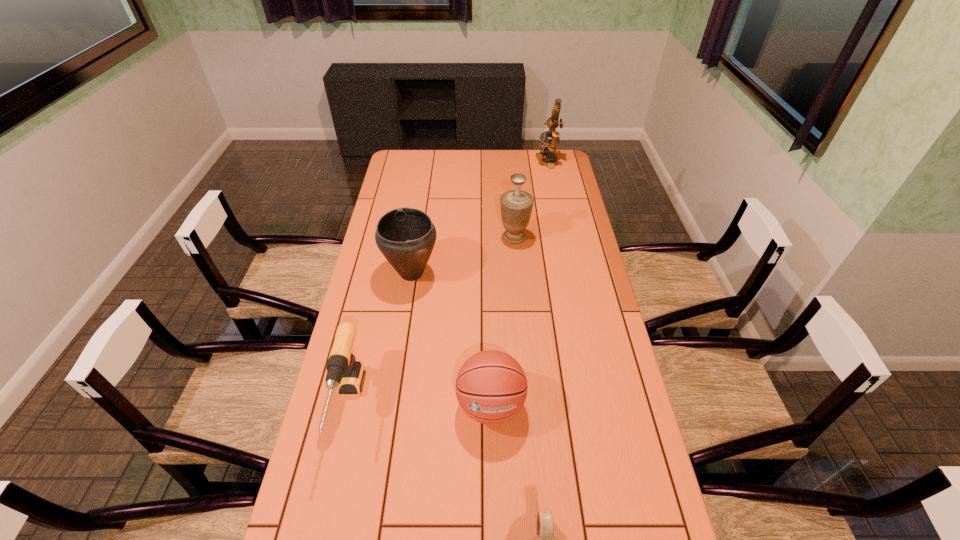
Locate an element on the screen. Image resolution: width=960 pixels, height=540 pixels. the farthest object is located at coordinates (548, 149).

The image size is (960, 540). What are the coordinates of `the tallest object` in the screenshot? It's located at (548, 149).

Where is `the fifth shortest object`? the fifth shortest object is located at coordinates (516, 205).

This screenshot has height=540, width=960. In order to click on the tallest urn in this screenshot , I will do `click(516, 205)`.

Locate an element on the screen. the fourth nearest object is located at coordinates (405, 236).

At what (x,y) coordinates should I click in order to perform the action: click on the second tallest urn. Please return your answer as a coordinate pair (x, y). Looking at the image, I should click on (405, 236).

The image size is (960, 540). Find the location of `basketball`. basketball is located at coordinates (491, 387).

The width and height of the screenshot is (960, 540). In order to click on drill in this screenshot , I will do `click(343, 371)`.

Find the location of a particular element. This screenshot has height=540, width=960. vacant area situated 0.260m on the front of the rightmost object is located at coordinates (557, 202).

Where is `free space located on the left of the tallest urn`? free space located on the left of the tallest urn is located at coordinates (472, 237).